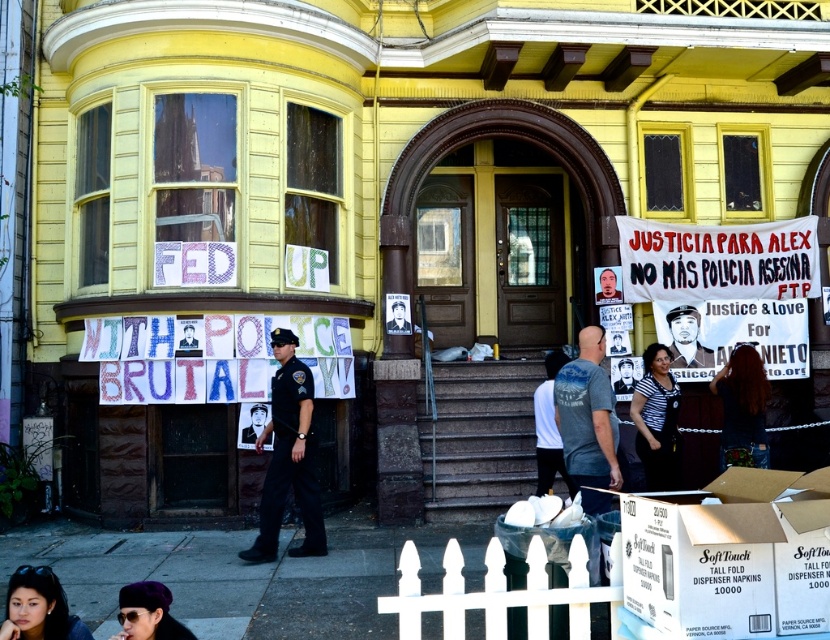
Question: Can you confirm if striped shirt at center is positioned to the left of smooth cardboard poster at center?

Choices:
 (A) yes
 (B) no

Answer: (B)

Question: Is smooth skin face at lower left below white fabric shirt at center?

Choices:
 (A) yes
 (B) no

Answer: (B)

Question: Among these points, which one is farthest from the camera?

Choices:
 (A) (664, 417)
 (B) (188, 340)

Answer: (B)

Question: Which of the following is the closest to the observer?

Choices:
 (A) purple fabric headscarf at lower left
 (B) black paper poster at center
 (C) black matte poster at center

Answer: (A)

Question: Based on their relative distances, which object is farther from the black paper poster at center?

Choices:
 (A) purple fabric headscarf at lower left
 (B) black matte photo at center
 (C) dark blue uniform at center
 (D) smooth cardboard poster at center

Answer: (A)

Question: Does dark brown hair at lower right have a lesser width compared to black matte photo at center?

Choices:
 (A) yes
 (B) no

Answer: (A)